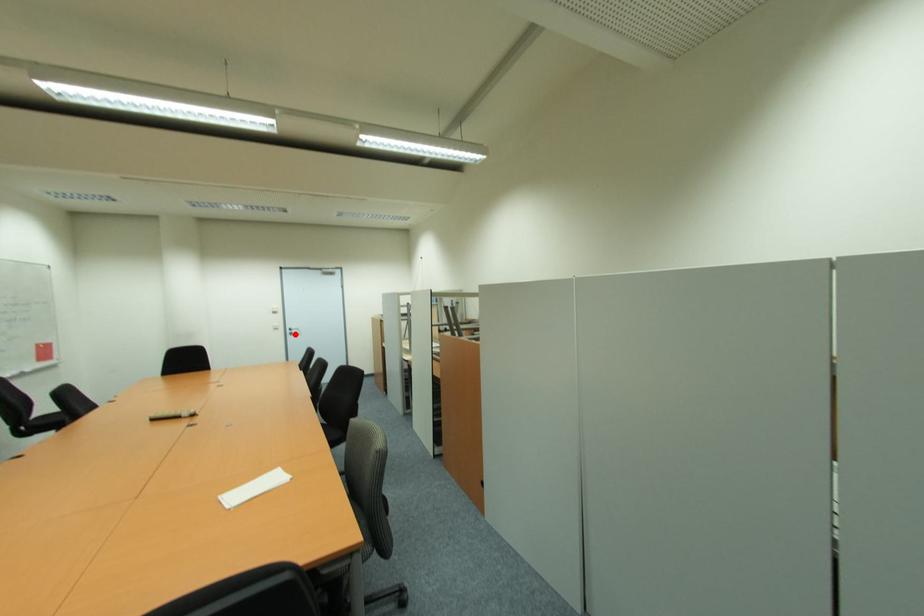
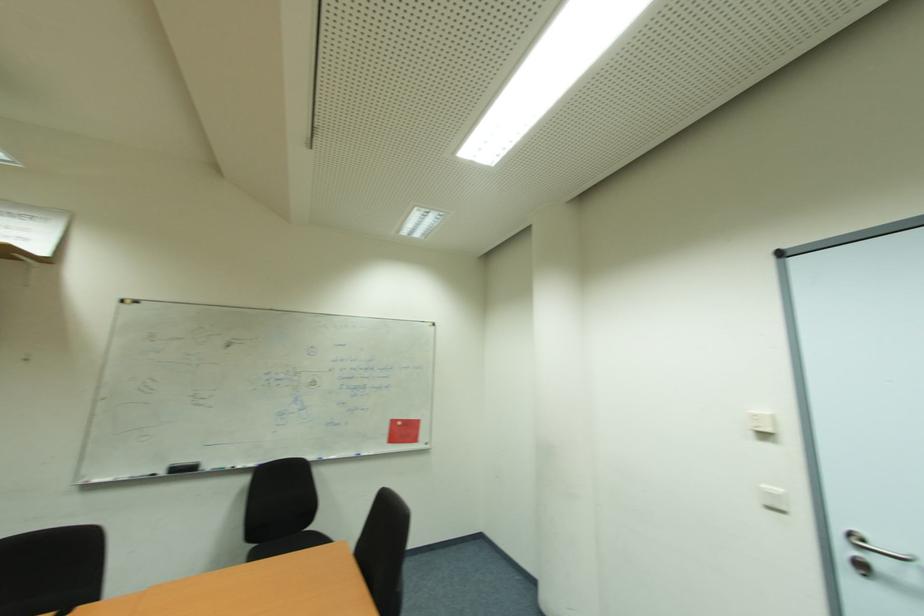
Locate, in the second image, the point that corresponds to the highlighted location in the first image.

(869, 570)